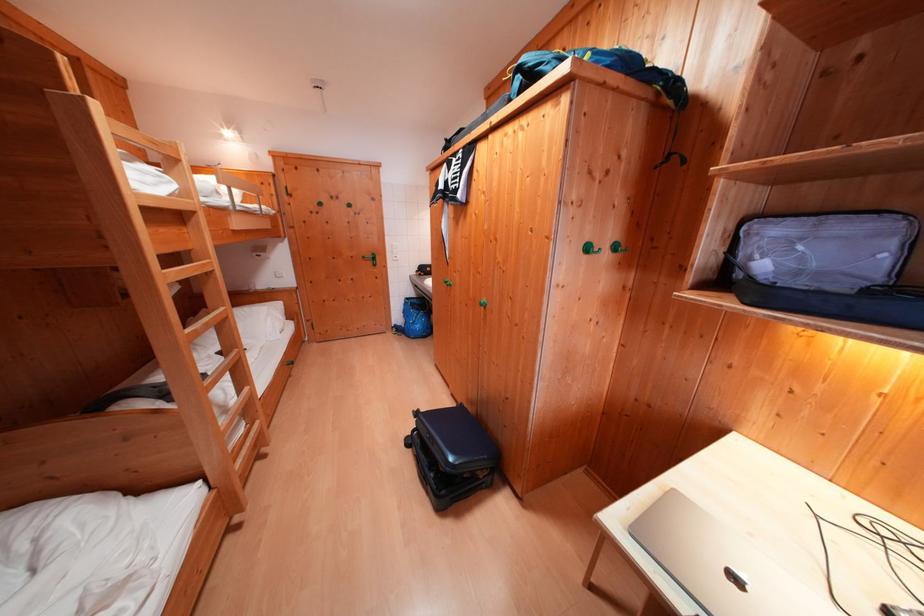
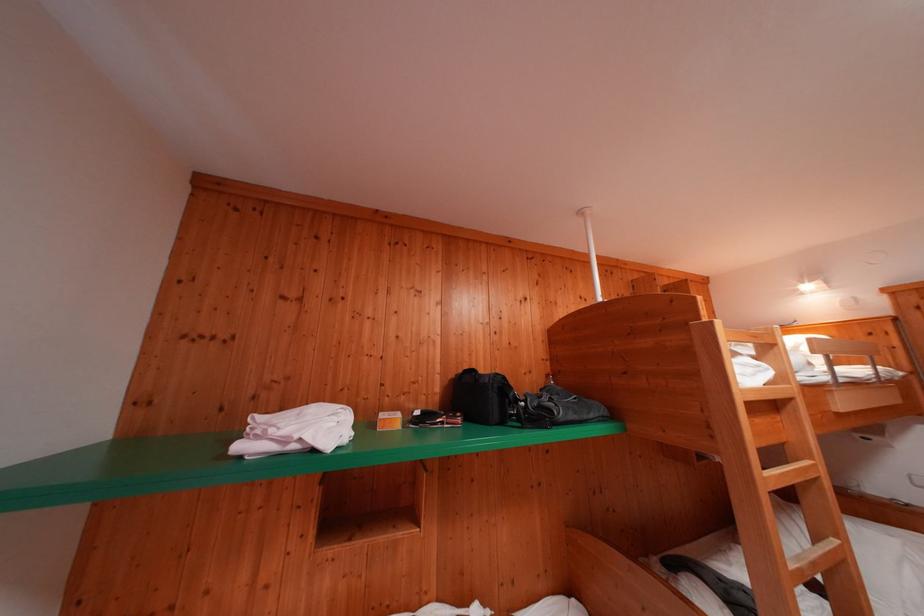
Where in the second image is the point corresponding to pixel 232 313 from the first image?

(843, 545)